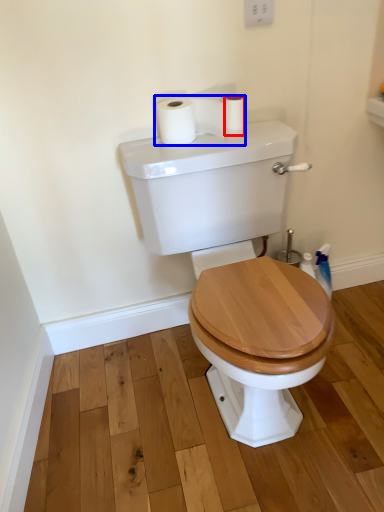
Question: Among these objects, which one is farthest to the camera, toilet paper (highlighted by a red box) or toilet paper (highlighted by a blue box)?

Choices:
 (A) toilet paper
 (B) toilet paper

Answer: (A)